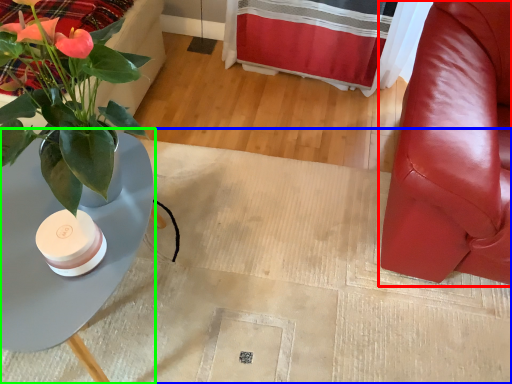
Question: Considering the real-world distances, which object is farthest from chair (highlighted by a red box)? plain (highlighted by a blue box) or table (highlighted by a green box)?

Choices:
 (A) plain
 (B) table

Answer: (B)